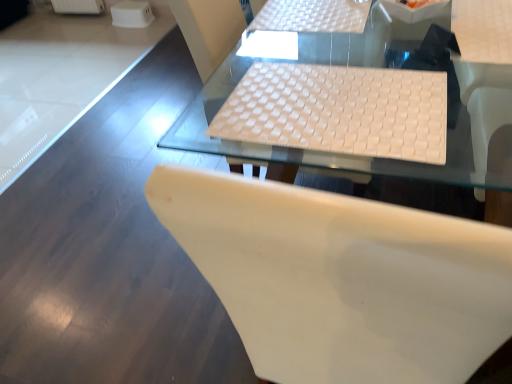
The width and height of the screenshot is (512, 384). In order to click on vacant area situated to the left side of white woven mat at center, the second table in the top-to-bottom sequence in this screenshot , I will do `click(151, 259)`.